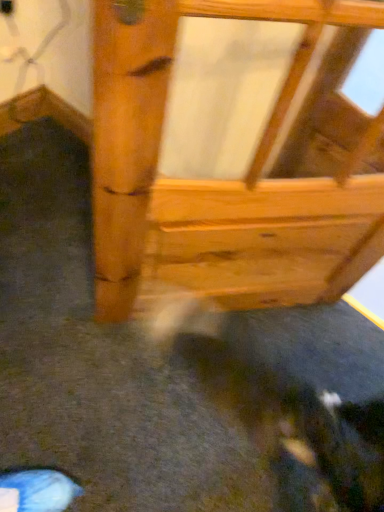
This screenshot has width=384, height=512. I want to click on free location in front of natural wood drawer at center, so click(x=146, y=412).